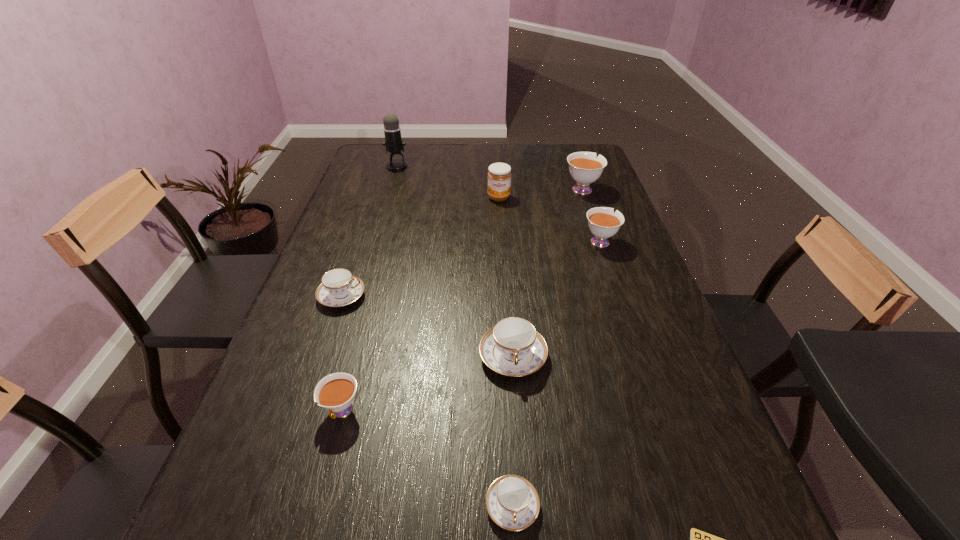
The height and width of the screenshot is (540, 960). In order to click on free space at the left edge of the desktop in this screenshot , I will do `click(373, 242)`.

Identify the location of free region at the right edge of the desktop. This screenshot has width=960, height=540. (689, 416).

In order to click on free space at the far right corner of the desktop in this screenshot , I will do `click(577, 148)`.

Identify the location of free space between the microphone and the smallest white teacup. This screenshot has height=540, width=960. (370, 289).

Locate an element on the screen. Image resolution: width=960 pixels, height=540 pixels. vacant space that's between the microphone and the nearest white teacup is located at coordinates (370, 289).

What are the coordinates of `unoccupied area between the leftmost white teacup and the tallest object` in the screenshot? It's located at click(x=370, y=289).

The height and width of the screenshot is (540, 960). Identify the location of free spot between the orange jam and the fourth nearest teacup. point(420,247).

Image resolution: width=960 pixels, height=540 pixels. I want to click on free point between the shortest teacup and the leftmost blue teacup, so click(427, 401).

Image resolution: width=960 pixels, height=540 pixels. What are the coordinates of `blank region between the farthest blue teacup and the eighth tallest object` in the screenshot? It's located at (427, 401).

This screenshot has height=540, width=960. Identify the location of object that can be found as the fourth closest to the orange jam. (339, 287).